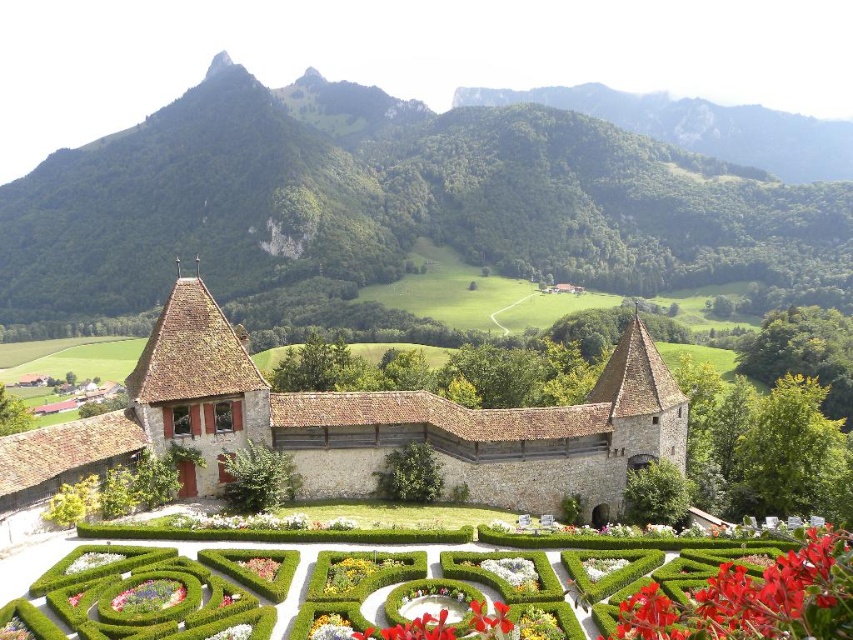
Which is behind, point (297, 396) or point (271, 580)?

Point (297, 396)

In the scene shown: Which is more to the left, brown stone church at center or fluffy pink flower at lower center?

Positioned to the left is fluffy pink flower at lower center.

This screenshot has height=640, width=853. I want to click on brown stone church at center, so click(352, 426).

You are a GUI agent. You are given a task and a screenshot of the screen. Output one action in this format:
    pyautogui.click(x=<x>, y=<y>)
    Task: Click on the brown stone church at center
    This screenshot has height=640, width=853.
    Given the screenshot: What is the action you would take?
    pyautogui.click(x=352, y=426)

Between brown stone church at center and vivid purple petals at lower left, which one is positioned higher?

Positioned higher is brown stone church at center.

Can you confirm if brown stone church at center is positioned to the right of vivid purple petals at lower left?

Yes, brown stone church at center is to the right of vivid purple petals at lower left.

Find the location of a particular element. The height and width of the screenshot is (640, 853). brown stone church at center is located at coordinates (352, 426).

At what (x,y) coordinates should I click in order to perform the action: click on brown stone church at center. Please return your answer as a coordinate pair (x, y). This screenshot has height=640, width=853. Looking at the image, I should click on (352, 426).

Between red matte flower at lower right and fluffy pink flower at lower center, which one appears on the right side from the viewer's perspective?

red matte flower at lower right is more to the right.

Which is above, red matte flower at lower right or fluffy pink flower at lower center?

Positioned higher is red matte flower at lower right.

At what (x,y) coordinates should I click in order to perform the action: click on red matte flower at lower right. Please return your answer as a coordinate pair (x, y). The width and height of the screenshot is (853, 640). Looking at the image, I should click on click(x=756, y=600).

Locate an element on the screen. Image resolution: width=853 pixels, height=640 pixels. red matte flower at lower right is located at coordinates (756, 600).